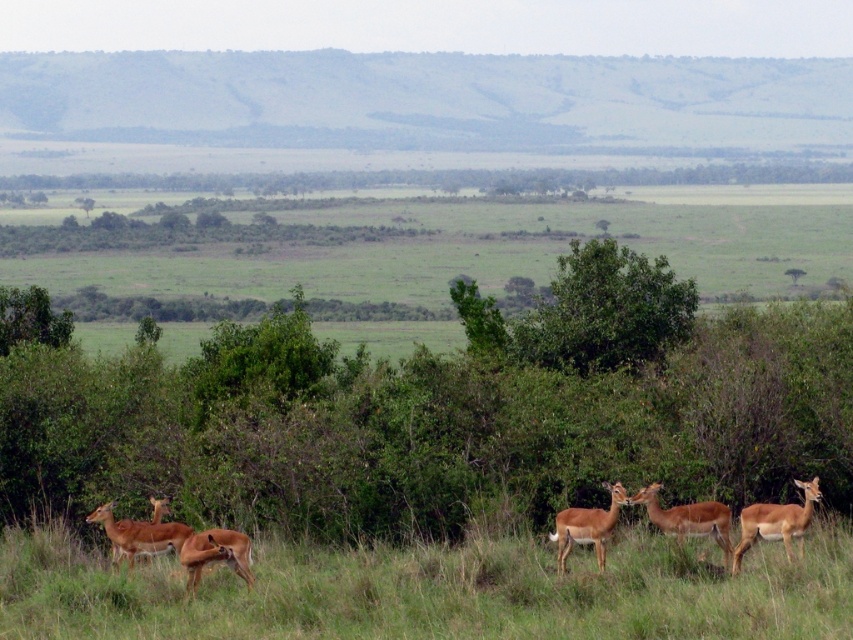
Question: Can you confirm if green grass at center is wider than green leafy tree at center?

Choices:
 (A) yes
 (B) no

Answer: (B)

Question: Is the position of green leafy tree at center more distant than that of green leafy bush at upper left?

Choices:
 (A) yes
 (B) no

Answer: (B)

Question: Which is farther from the green leafy bush at upper left?

Choices:
 (A) brown velvet antelope at lower left
 (B) green leafy tree at center

Answer: (A)

Question: Which point is closer to the camera taking this photo?

Choices:
 (A) click(x=16, y=301)
 (B) click(x=625, y=250)
 (C) click(x=624, y=504)

Answer: (C)

Question: Which of the following is the farthest from the observer?

Choices:
 (A) (202, 547)
 (B) (10, 317)
 (C) (746, 538)
 (D) (651, 488)

Answer: (B)

Question: Can you confirm if brown glossy antelope at center is smaller than brown matte antelope at center?

Choices:
 (A) yes
 (B) no

Answer: (A)